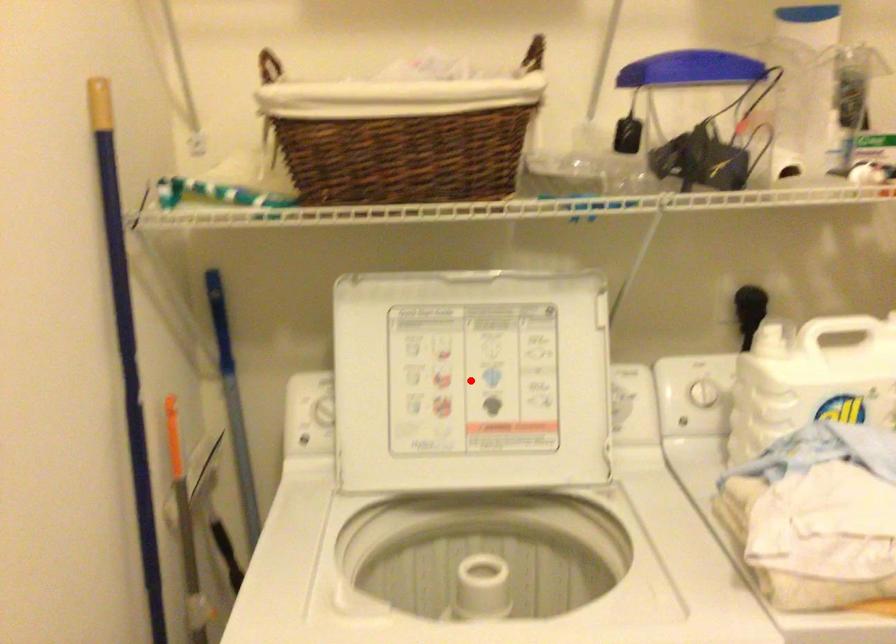
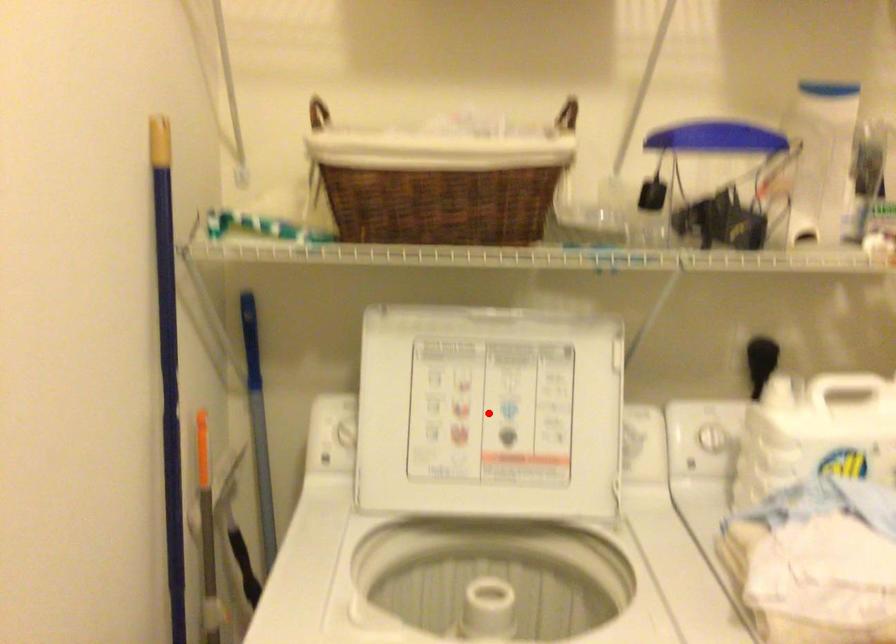
I am providing you with two images of the same scene from different viewpoints. A red point is marked on the first image and another point is marked on the second image. Are the points marked in image1 and image2 representing the same 3D position?

Yes